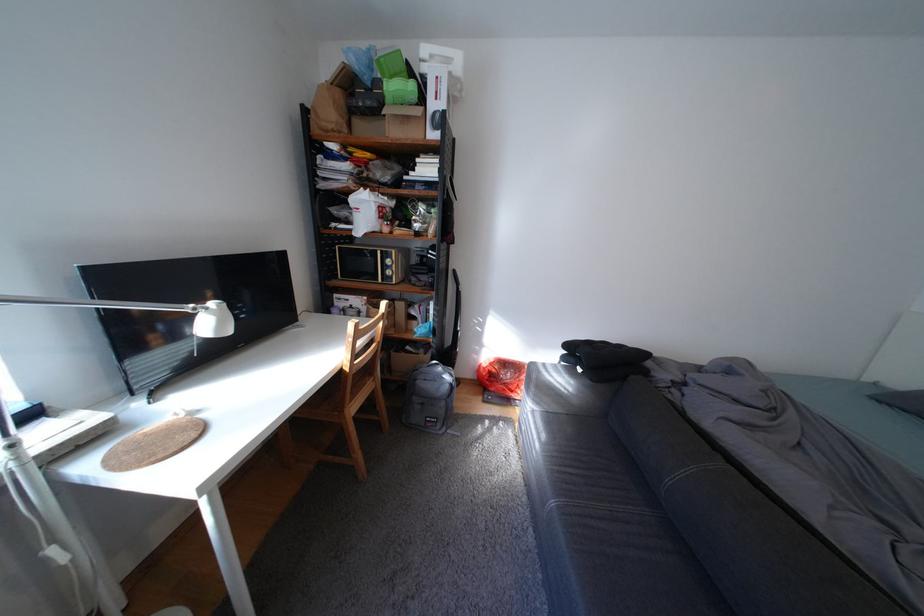
Where would you sit the sofa sitting surface? Please return your answer as a coordinate pair (x, y).

(604, 516)